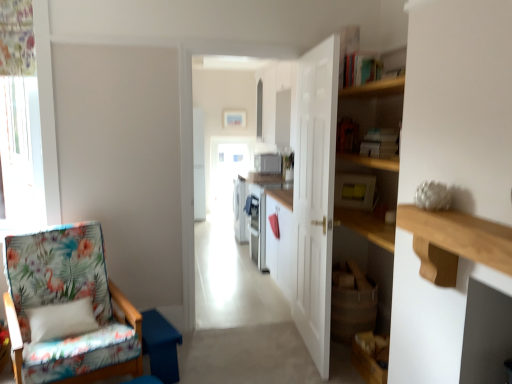
The width and height of the screenshot is (512, 384). Find the location of `empty space that is ontop of wooden at right (from a real-world perspective)`. empty space that is ontop of wooden at right (from a real-world perspective) is located at coordinates (469, 218).